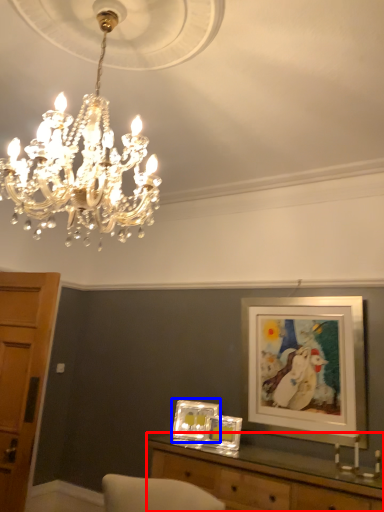
Question: Which point is closer to the camera, table (highlighted by a red box) or picture frame (highlighted by a blue box)?

Choices:
 (A) table
 (B) picture frame

Answer: (A)